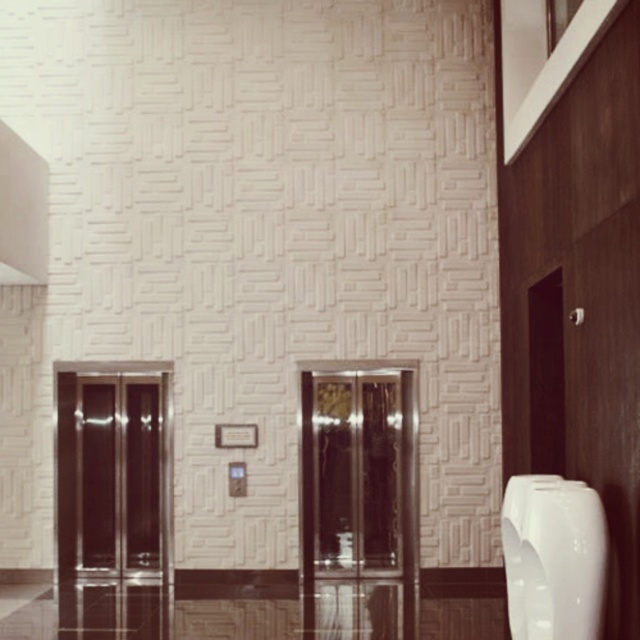
You are a maintenance worker needing to clean both the shiny glass elevator at center and the white glossy urinal at right. Which object requires more time to clean due to its size?

The shiny glass elevator at center requires more time to clean because it is bigger than the white glossy urinal at right.

You are standing in the lobby and need to locate the shiny metallic elevator doors at left. According to the coordinates provided, where should you look relative to your current position?

The shiny metallic elevator doors at left are located at coordinates point (115, 474), which would be to your left and slightly ahead of you.